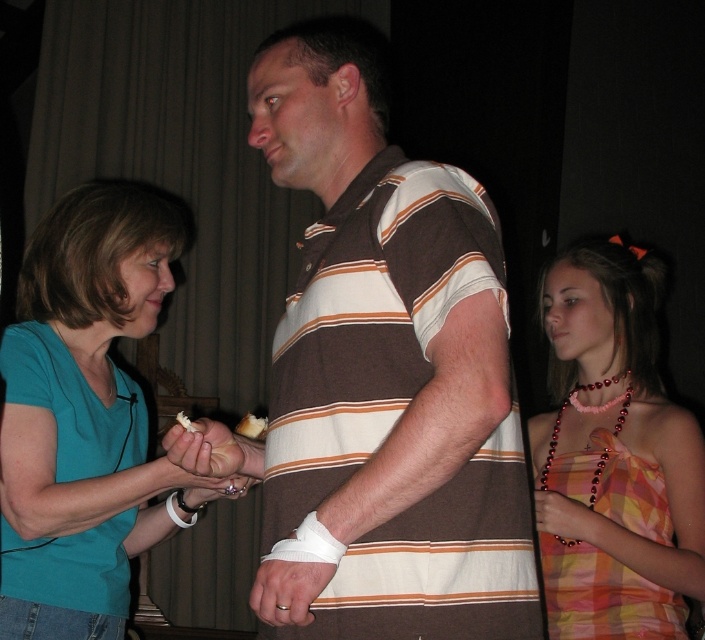
This screenshot has width=705, height=640. I want to click on pink beaded necklace at upper right, so click(613, 456).

Who is higher up, pink beaded necklace at upper right or white fabric bandage at lower center?

pink beaded necklace at upper right

At what (x,y) coordinates should I click in order to perform the action: click on pink beaded necklace at upper right. Please return your answer as a coordinate pair (x, y). This screenshot has width=705, height=640. Looking at the image, I should click on (613, 456).

Who is positioned more to the right, white fabric bandage at lower center or white creamy cake at center?

Positioned to the right is white fabric bandage at lower center.

Does white fabric bandage at lower center appear on the left side of white creamy cake at center?

Incorrect, white fabric bandage at lower center is not on the left side of white creamy cake at center.

Who is more forward, (331,548) or (257,428)?

Point (331,548)

Where is `white fabric bandage at lower center`? This screenshot has height=640, width=705. white fabric bandage at lower center is located at coordinates (307, 545).

Does brown striped shirt at center have a larger size compared to white fabric bandage at lower center?

Yes, brown striped shirt at center is bigger than white fabric bandage at lower center.

Is point (412, 573) closer to viewer compared to point (288, 538)?

Yes, point (412, 573) is in front of point (288, 538).

Does point (341, 353) come in front of point (298, 548)?

No, it is behind (298, 548).

The image size is (705, 640). Identify the location of brown striped shirt at center. (386, 371).